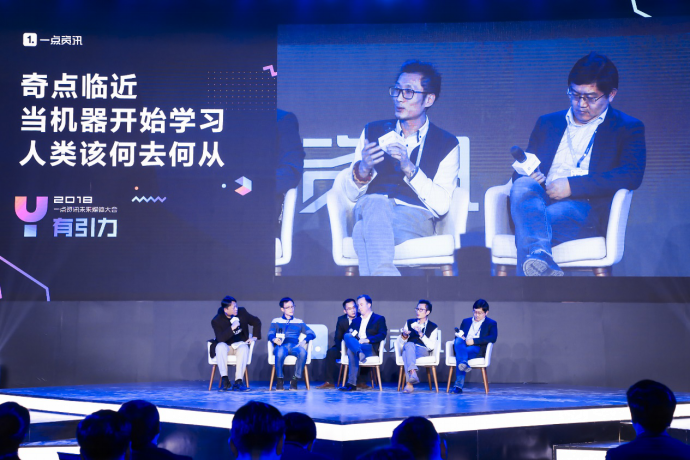
Find the location of a particular element. chair is located at coordinates pos(483,360).